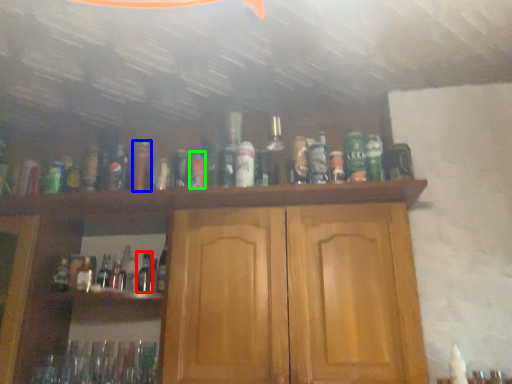
Question: Which object is positioned closest to bottle (highlighted by a red box)? Select from bottle (highlighted by a blue box) and bottle (highlighted by a green box).

Choices:
 (A) bottle
 (B) bottle

Answer: (A)